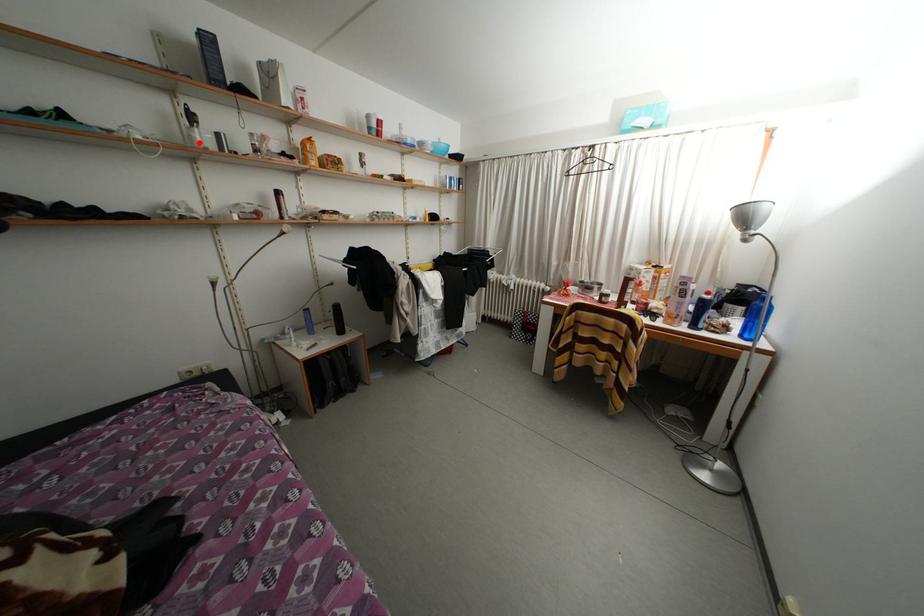
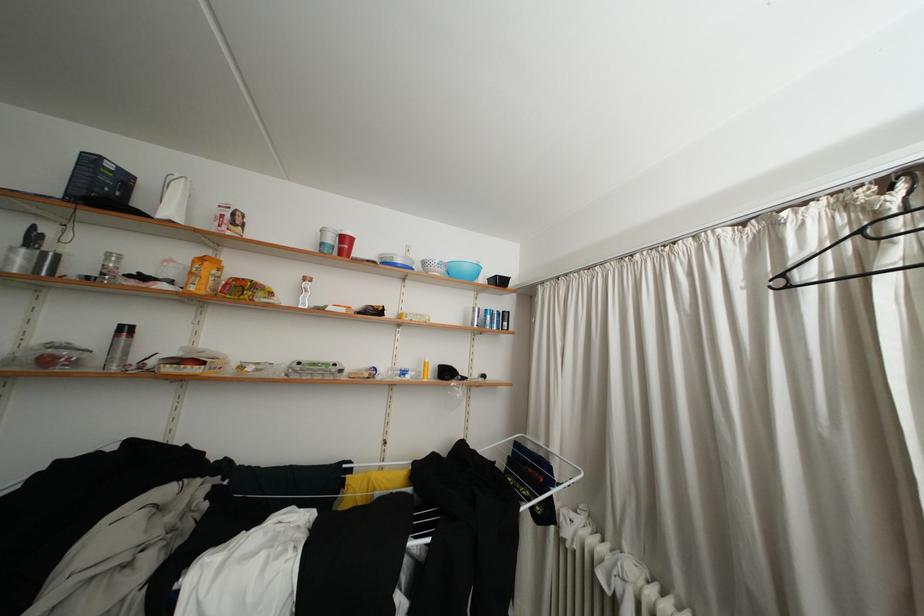
In the second image, find the point that corresponds to the highlighted location in the first image.

(17, 264)